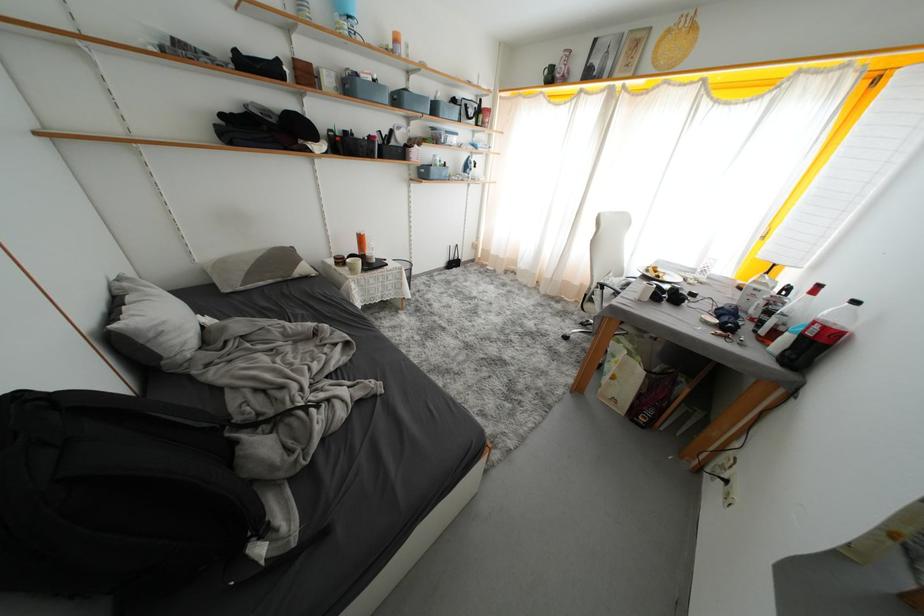
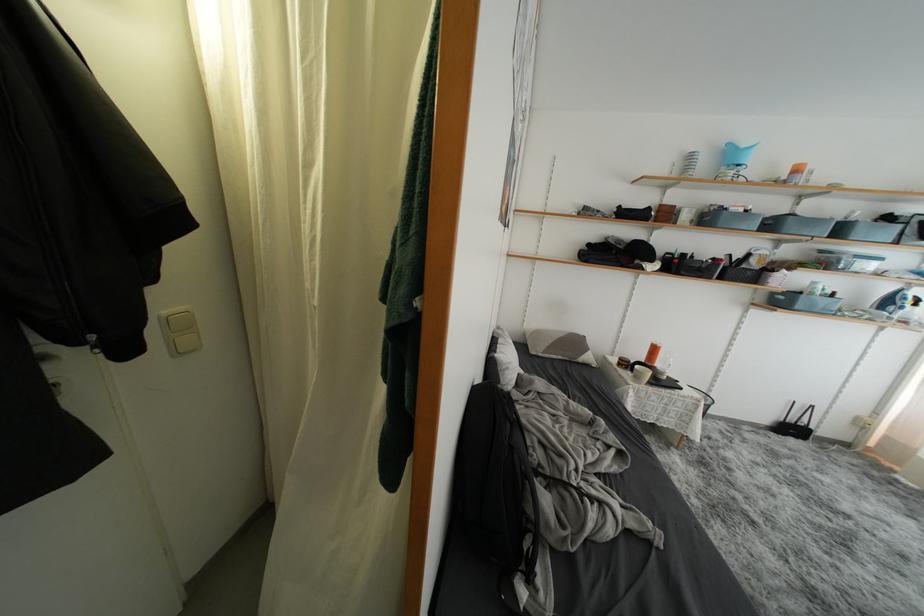
Find the pixel in the second image that matches [459,267] in the first image.

(797, 434)